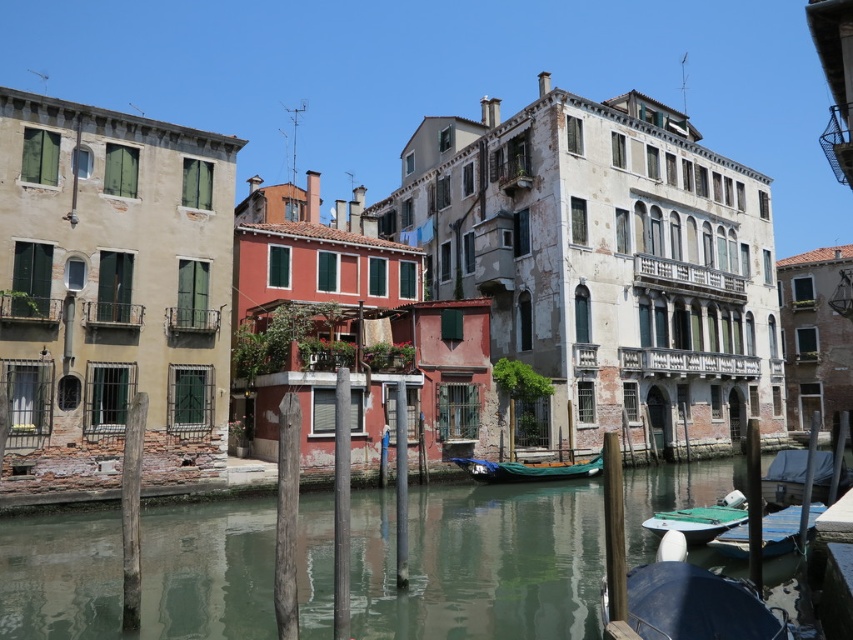
Which is more to the right, white tarp-covered boat at lower right or green canvas boat at center?

white tarp-covered boat at lower right

Can you confirm if white tarp-covered boat at lower right is positioned below green canvas boat at center?

No, white tarp-covered boat at lower right is not below green canvas boat at center.

Find the location of a particular element. The height and width of the screenshot is (640, 853). white tarp-covered boat at lower right is located at coordinates (x=784, y=477).

Where is `white tarp-covered boat at lower right`? Image resolution: width=853 pixels, height=640 pixels. white tarp-covered boat at lower right is located at coordinates (784, 477).

Can you confirm if green canvas boat at lower right is thinner than green canvas boat at center?

Indeed, green canvas boat at lower right has a lesser width compared to green canvas boat at center.

Does green canvas boat at lower right have a greater height compared to green canvas boat at center?

No, green canvas boat at lower right is not taller than green canvas boat at center.

Measure the distance between green canvas boat at lower right and camera.

green canvas boat at lower right is 36.11 meters away from camera.

Locate an element on the screen. green canvas boat at lower right is located at coordinates (780, 531).

Does blue tarpaulin boat at lower right have a lesser height compared to white tarp-covered boat at lower right?

Correct, blue tarpaulin boat at lower right is not as tall as white tarp-covered boat at lower right.

Between point (668, 589) and point (824, 465), which one is positioned in front?

Point (668, 589) is in front.

In order to click on blue tarpaulin boat at lower right in this screenshot , I will do `click(694, 600)`.